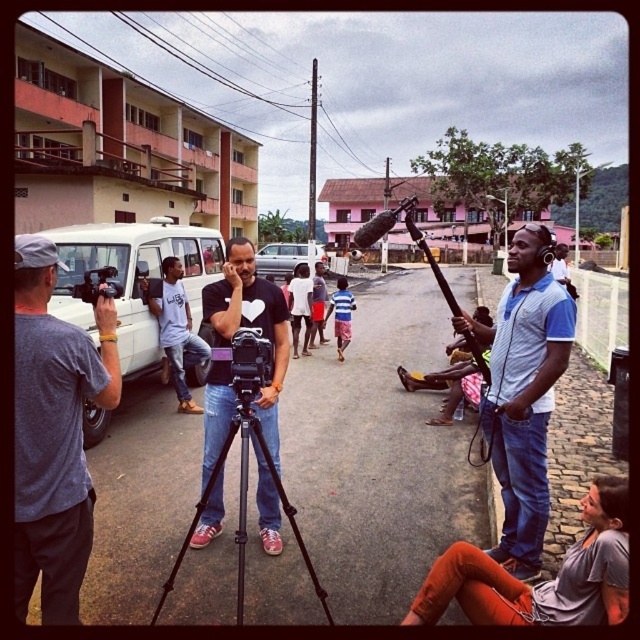
Can you confirm if gray fabric camera at left is taller than light blue jeans at center?

Incorrect, gray fabric camera at left's height is not larger of light blue jeans at center's.

Between point (45, 602) and point (172, 312), which one is positioned in front?

Point (45, 602)

Where is `gray fabric camera at left`? gray fabric camera at left is located at coordinates (54, 433).

Who is more forward, (253, 337) or (348, 310)?

Point (253, 337) is more forward.

Is black plastic camera at center positioned behind striped cotton shirt at center?

That is False.

Is point (259, 387) more distant than point (324, 320)?

That is False.

You are a GUI agent. You are given a task and a screenshot of the screen. Output one action in this format:
    pyautogui.click(x=<x>, y=<y>)
    Task: Click on the black plastic camera at center
    
    Given the screenshot: What is the action you would take?
    pyautogui.click(x=250, y=362)

Is orange denim pants at lower right smaller than white matte camera at center?

Yes, orange denim pants at lower right is smaller than white matte camera at center.

Between point (538, 609) and point (221, 301), which one is positioned behind?

Positioned behind is point (221, 301).

Image resolution: width=640 pixels, height=640 pixels. I want to click on orange denim pants at lower right, so click(544, 580).